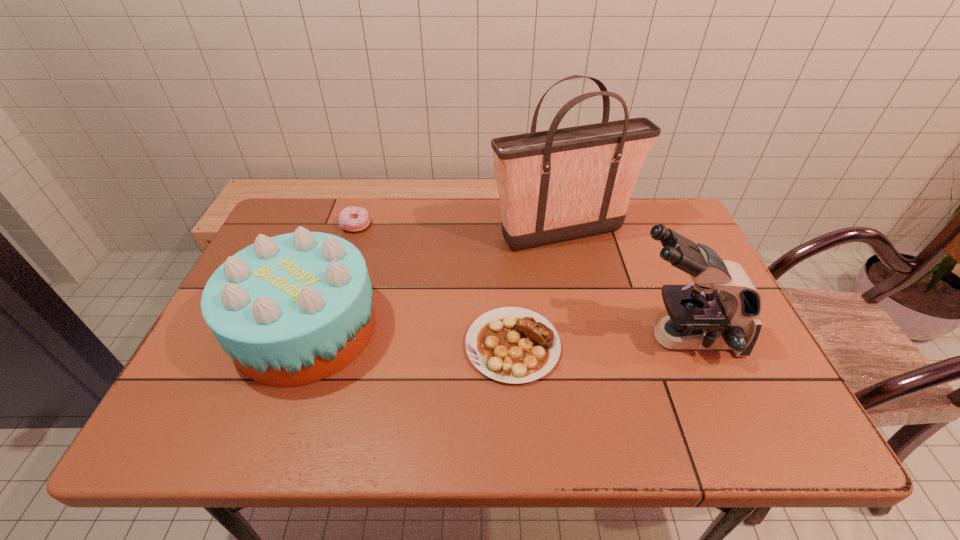
Where is `free region located 0.330m on the front of the doughnut`? free region located 0.330m on the front of the doughnut is located at coordinates (324, 319).

Where is `vacant space positioned 0.330m on the left of the steak`? vacant space positioned 0.330m on the left of the steak is located at coordinates (324, 346).

You are a GUI agent. You are given a task and a screenshot of the screen. Output one action in this format:
    pyautogui.click(x=<x>, y=<y>)
    Task: Click on the shopping bag present at the far edge
    Image resolution: width=960 pixels, height=540 pixels.
    Given the screenshot: What is the action you would take?
    pyautogui.click(x=557, y=185)

Where is `doughnut situated at the far edge`? doughnut situated at the far edge is located at coordinates (353, 219).

This screenshot has height=540, width=960. I want to click on object that is at the left edge, so [x=293, y=309].

The width and height of the screenshot is (960, 540). What are the coordinates of `object that is at the right edge` in the screenshot? It's located at (700, 317).

Identify the location of free point at the far edge. This screenshot has height=540, width=960. (502, 244).

Locate an element on the screen. vacant space at the near edge is located at coordinates (569, 411).

Identify the location of vacant space at the right edge of the desktop. Image resolution: width=960 pixels, height=540 pixels. (651, 269).

In the image, there is a desktop. Where is `vacant space at the near left corner`? This screenshot has width=960, height=540. vacant space at the near left corner is located at coordinates (201, 434).